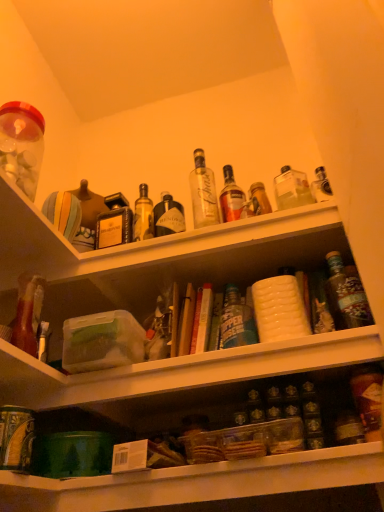
Question: From a real-world perspective, is translucent plastic jar at upper left above or below clear plastic container at center, positioned as the 1th shelf in bottom-to-top order?

Choices:
 (A) above
 (B) below

Answer: (A)

Question: Is translucent plastic jar at upper left to the left or to the right of clear plastic container at center, arranged as the second shelf when viewed from the top, in the image?

Choices:
 (A) right
 (B) left

Answer: (B)

Question: Which object is the farthest from the white textured container at center, the second shelf positioned from the bottom?

Choices:
 (A) shiny dark brown bottle at right, arranged as the second bottle when viewed from the front
 (B) clear plastic container at center, positioned as the 1th shelf in bottom-to-top order
 (C) translucent plastic jar at upper left
 (D) translucent glass bottle at lower right, marked as the 1th bottle in a front-to-back arrangement

Answer: (D)

Question: Which of these objects is positioned farthest from the clear plastic container at center, arranged as the second shelf when viewed from the top?

Choices:
 (A) white textured container at center, the second shelf positioned from the bottom
 (B) translucent plastic jar at upper left
 (C) translucent glass bottle at lower right, marked as the 1th bottle in a front-to-back arrangement
 (D) shiny dark brown bottle at right, acting as the 2th bottle starting from the bottom

Answer: (B)